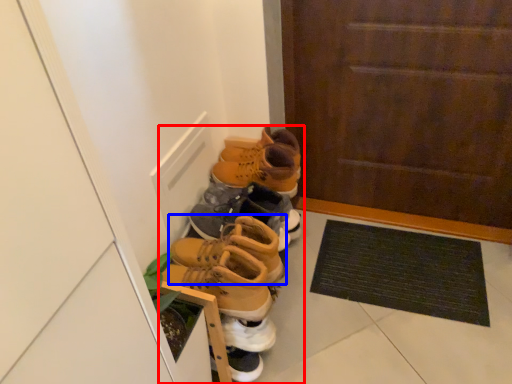
Question: Which point is closer to the camera, footwear (highlighted by a red box) or footwear (highlighted by a blue box)?

Choices:
 (A) footwear
 (B) footwear

Answer: (A)